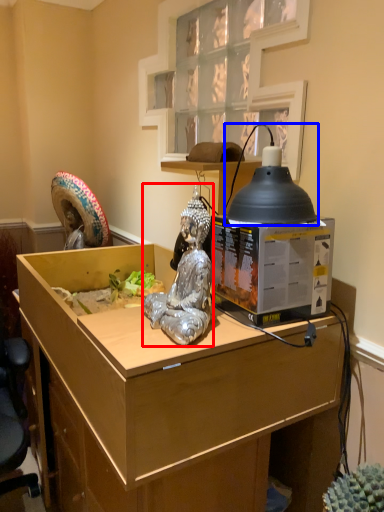
Question: Among these objects, which one is farthest to the camera, person (highlighted by a red box) or lamp (highlighted by a blue box)?

Choices:
 (A) person
 (B) lamp

Answer: (B)